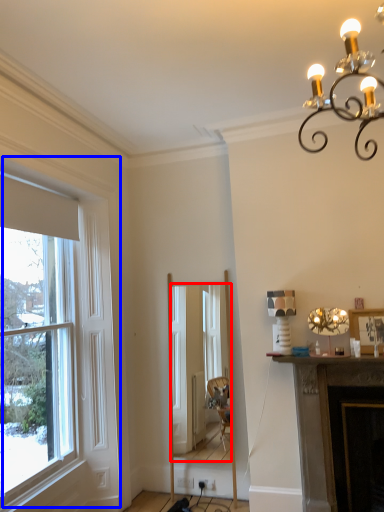
Question: Which point is closer to the camera, mirror (highlighted by a red box) or window (highlighted by a blue box)?

Choices:
 (A) mirror
 (B) window

Answer: (B)